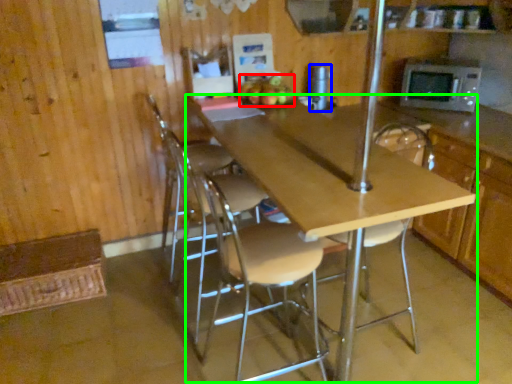
Question: Which is nearer to the apple (highlighted by a red box)? appliance (highlighted by a blue box) or table (highlighted by a green box).

Choices:
 (A) appliance
 (B) table

Answer: (A)